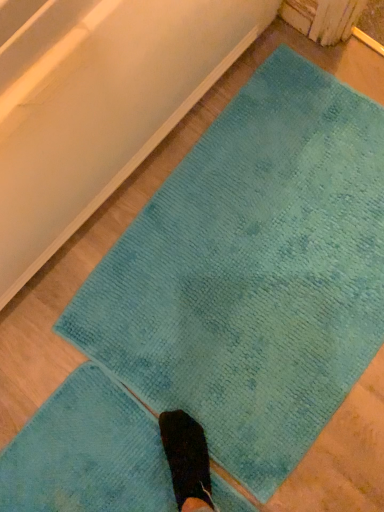
This screenshot has width=384, height=512. What do you see at coordinates (87, 453) in the screenshot?
I see `teal soft rug at center` at bounding box center [87, 453].

Identify the location of teal soft rug at center. (87, 453).

In order to click on teal soft rug at center in this screenshot , I will do `click(87, 453)`.